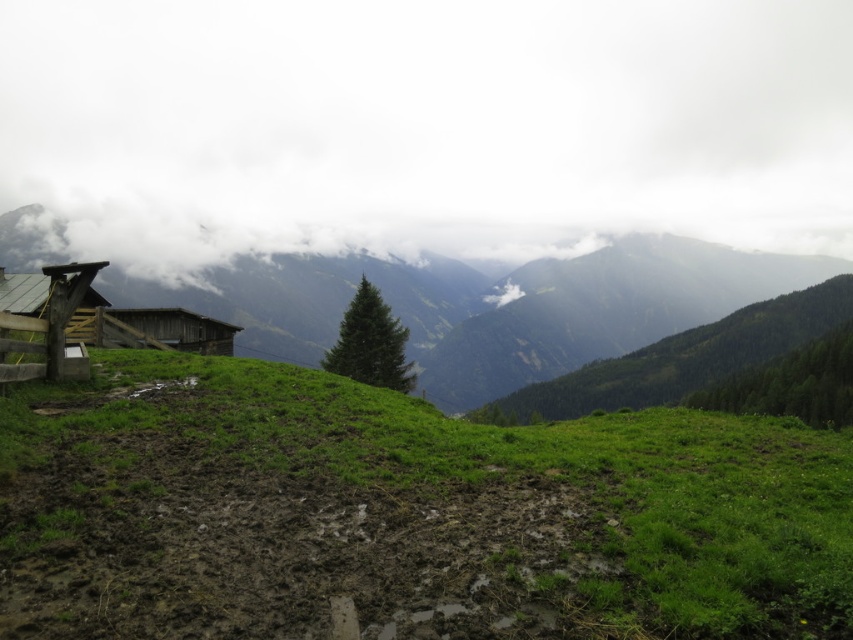
Which is in front, point (277, 593) or point (569, 275)?

Point (277, 593) is more forward.

Is green grassy at lower left taller than green grassy hillside at left?

Incorrect, green grassy at lower left's height is not larger of green grassy hillside at left's.

The width and height of the screenshot is (853, 640). What do you see at coordinates (404, 513) in the screenshot?
I see `green grassy at lower left` at bounding box center [404, 513].

The image size is (853, 640). In order to click on green grassy at lower left in this screenshot , I will do `click(404, 513)`.

Can you confirm if white fluffy cloud at upper center is smaller than wooden cabin at left?

Incorrect, white fluffy cloud at upper center is not smaller in size than wooden cabin at left.

Who is positioned more to the right, white fluffy cloud at upper center or wooden cabin at left?

Positioned to the right is white fluffy cloud at upper center.

Is point (270, 150) behind point (155, 316)?

Yes.

This screenshot has height=640, width=853. Identify the location of white fluffy cloud at upper center. (426, 125).

Does white fluffy cloud at upper center appear on the right side of green grassy hillside at left?

Incorrect, white fluffy cloud at upper center is not on the right side of green grassy hillside at left.

Is white fluffy cloud at upper center to the left of green grassy hillside at left from the viewer's perspective?

Indeed, white fluffy cloud at upper center is positioned on the left side of green grassy hillside at left.

Who is more forward, (x=734, y=54) or (x=436, y=352)?

Point (x=436, y=352) is more forward.

You are a GUI agent. You are given a task and a screenshot of the screen. Output one action in this format:
    pyautogui.click(x=<x>, y=<y>)
    Task: Click on the white fluffy cloud at upper center
    The height and width of the screenshot is (640, 853).
    Given the screenshot: What is the action you would take?
    426,125